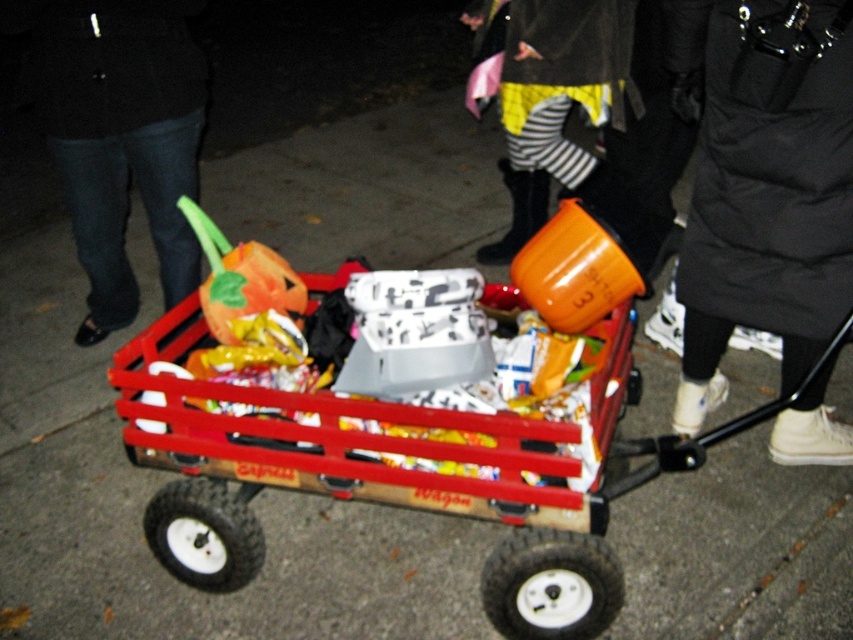
Who is more forward, (689, 401) or (612, 0)?

Point (689, 401) is more forward.

Looking at this image, does black puffy coat at upper right have a lesser height compared to striped fabric pants at center?

No, black puffy coat at upper right is not shorter than striped fabric pants at center.

Who is more distant from viewer, (x=730, y=307) or (x=592, y=177)?

Point (x=592, y=177)

Locate an element on the screen. The image size is (853, 640). black puffy coat at upper right is located at coordinates (762, 186).

Where is `black puffy coat at upper right`? Image resolution: width=853 pixels, height=640 pixels. black puffy coat at upper right is located at coordinates (762, 186).

Does black puffy coat at upper right have a greater width compared to brushed metal pants at lower left?

No.

Between point (811, 321) and point (120, 298), which one is positioned behind?

Point (120, 298)

You are a GUI agent. You are given a task and a screenshot of the screen. Output one action in this format:
    pyautogui.click(x=<x>, y=<y>)
    Task: Click on the black puffy coat at upper right
    This screenshot has width=853, height=640.
    Given the screenshot: What is the action you would take?
    pyautogui.click(x=762, y=186)

Does brushed metal pants at lower left lie in front of striped fabric pants at center?

Yes.

Can you confirm if brushed metal pants at lower left is thinner than striped fabric pants at center?

No, brushed metal pants at lower left is not thinner than striped fabric pants at center.

Where is `brushed metal pants at lower left`? brushed metal pants at lower left is located at coordinates (119, 134).